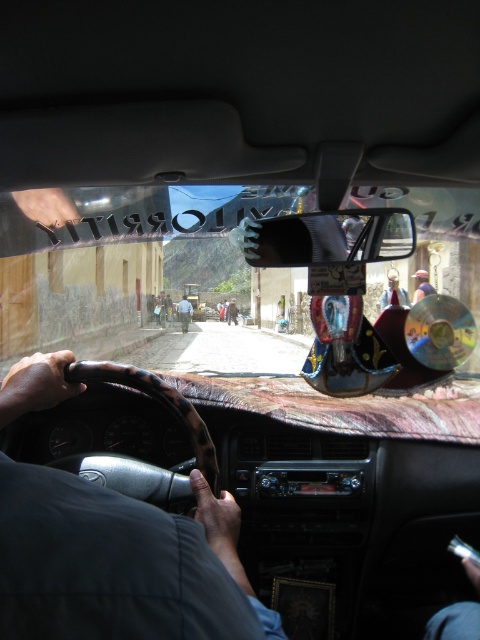
Who is positioned more to the right, matte glass windshield at center or light blue shirt at center?

Positioned to the right is matte glass windshield at center.

Identify the location of matte glass windshield at center. This screenshot has width=480, height=640. (137, 266).

This screenshot has width=480, height=640. What are the coordinates of `matte glass windshield at center` in the screenshot? It's located at (137, 266).

Measure the distance between point (202, 230) and camera.

Point (202, 230) and camera are 18.61 feet apart.

Which is below, matte glass windshield at center or black leather steering wheel at center?

black leather steering wheel at center

What do you see at coordinates (137, 266) in the screenshot?
I see `matte glass windshield at center` at bounding box center [137, 266].

At what (x,y) coordinates should I click in order to perform the action: click on matte glass windshield at center. Please return your answer as a coordinate pair (x, y). Looking at the image, I should click on (x=137, y=266).

Between point (0, 596) and point (179, 301), which one is positioned in front?

Point (0, 596)

Is the position of black leather steering wheel at center less distant than that of light blue shirt at center?

Yes, black leather steering wheel at center is in front of light blue shirt at center.

Find the location of a particular element. black leather steering wheel at center is located at coordinates (120, 563).